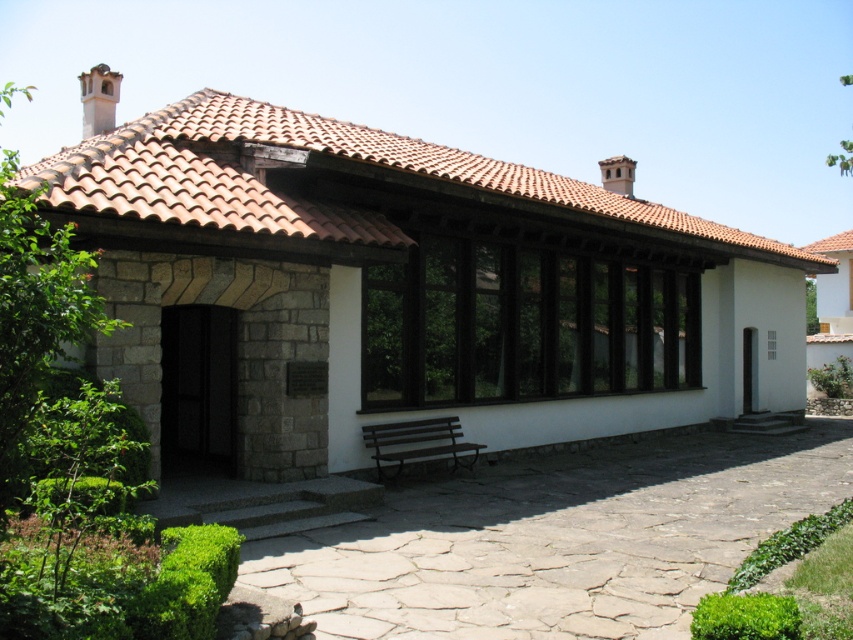
Question: Among these points, which one is farthest from the camera?

Choices:
 (A) (370, 456)
 (B) (643, 220)

Answer: (B)

Question: Is brown tile roof at upper center to the left of brown wooden bench at lower center from the viewer's perspective?

Choices:
 (A) no
 (B) yes

Answer: (A)

Question: Does brown tile roof at upper center appear under brown wooden bench at lower center?

Choices:
 (A) no
 (B) yes

Answer: (A)

Question: In this image, where is brown tile roof at upper center located relative to brown wooden bench at lower center?

Choices:
 (A) left
 (B) right

Answer: (B)

Question: Which of the following is the farthest from the observer?

Choices:
 (A) (376, 456)
 (B) (567, 179)

Answer: (B)